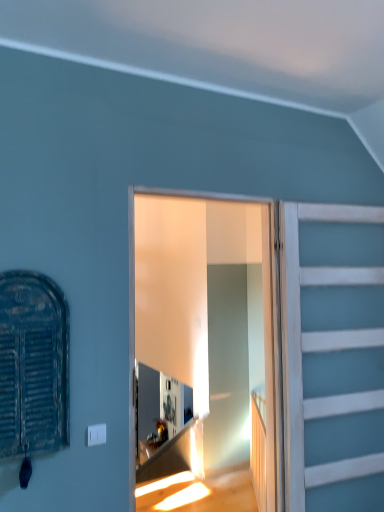
Question: Considering the relative positions of white painted wood at right and rusty metal shutter at left in the image provided, is white painted wood at right to the left of rusty metal shutter at left from the viewer's perspective?

Choices:
 (A) yes
 (B) no

Answer: (B)

Question: From the image's perspective, would you say white painted wood at right is positioned over rusty metal shutter at left?

Choices:
 (A) no
 (B) yes

Answer: (A)

Question: Are white painted wood at right and rusty metal shutter at left making contact?

Choices:
 (A) no
 (B) yes

Answer: (A)

Question: Does white painted wood at right come in front of rusty metal shutter at left?

Choices:
 (A) no
 (B) yes

Answer: (A)

Question: Is white painted wood at right to the right of rusty metal shutter at left from the viewer's perspective?

Choices:
 (A) no
 (B) yes

Answer: (B)

Question: From the image's perspective, is white painted wood at right under rusty metal shutter at left?

Choices:
 (A) no
 (B) yes

Answer: (B)

Question: Does rusty metal shutter at left appear on the right side of clear glass door at center?

Choices:
 (A) yes
 (B) no

Answer: (B)

Question: Considering the relative sizes of rusty metal shutter at left and clear glass door at center in the image provided, is rusty metal shutter at left taller than clear glass door at center?

Choices:
 (A) yes
 (B) no

Answer: (B)

Question: Is rusty metal shutter at left not inside clear glass door at center?

Choices:
 (A) yes
 (B) no

Answer: (A)

Question: From a real-world perspective, is rusty metal shutter at left under clear glass door at center?

Choices:
 (A) no
 (B) yes

Answer: (A)

Question: Considering the relative sizes of rusty metal shutter at left and clear glass door at center in the image provided, is rusty metal shutter at left wider than clear glass door at center?

Choices:
 (A) yes
 (B) no

Answer: (B)

Question: Considering the relative sizes of rusty metal shutter at left and clear glass door at center in the image provided, is rusty metal shutter at left smaller than clear glass door at center?

Choices:
 (A) no
 (B) yes

Answer: (B)

Question: Does clear glass door at center turn towards white painted wood at right?

Choices:
 (A) no
 (B) yes

Answer: (A)